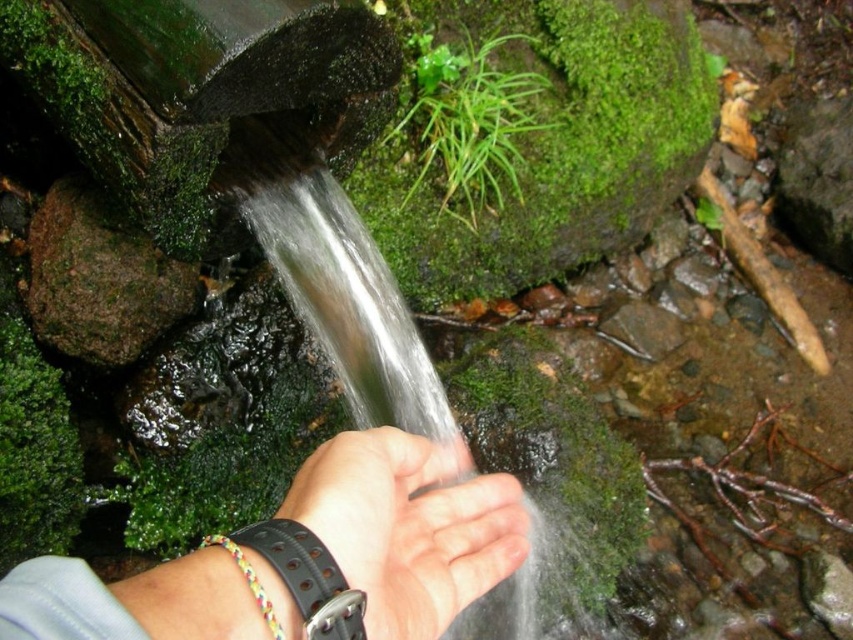
You are a jeweler examining two wristbands on a customer. The customer has a black leather wristband at center and a skinny leather wristband at lower center. Which wristband do you think has a larger width?

The black leather wristband at center might be wider than the skinny leather wristband at lower center, so the black leather wristband at center likely has a larger width.